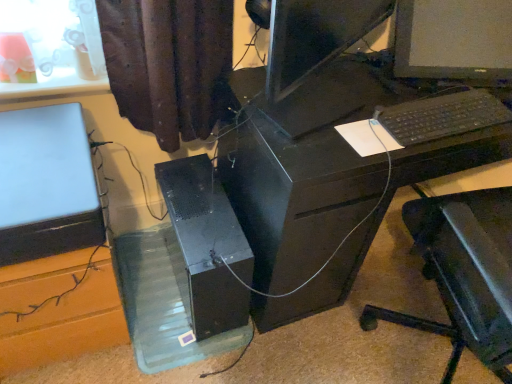
Question: Are black plastic keyboard at right and transparent plastic glass box at lower center located far from each other?

Choices:
 (A) yes
 (B) no

Answer: (B)

Question: Can transparent plastic glass box at lower center be found inside black plastic keyboard at right?

Choices:
 (A) no
 (B) yes

Answer: (A)

Question: Is the depth of black plastic keyboard at right less than that of transparent plastic glass box at lower center?

Choices:
 (A) no
 (B) yes

Answer: (B)

Question: Is transparent plastic glass box at lower center at the back of black plastic keyboard at right?

Choices:
 (A) no
 (B) yes

Answer: (A)

Question: Is black plastic keyboard at right taller than transparent plastic glass box at lower center?

Choices:
 (A) no
 (B) yes

Answer: (A)

Question: Is black plastic keyboard at right to the left of transparent plastic glass box at lower center from the viewer's perspective?

Choices:
 (A) yes
 (B) no

Answer: (B)

Question: Would you say black plastic desk at center contains black matte computer tower at center?

Choices:
 (A) no
 (B) yes

Answer: (A)

Question: Does black plastic desk at center come in front of black matte computer tower at center?

Choices:
 (A) no
 (B) yes

Answer: (B)

Question: From a real-world perspective, is black plastic desk at center on black matte computer tower at center?

Choices:
 (A) yes
 (B) no

Answer: (A)

Question: Does black plastic desk at center come behind black matte computer tower at center?

Choices:
 (A) yes
 (B) no

Answer: (B)

Question: Is black plastic desk at center not close to black matte computer tower at center?

Choices:
 (A) no
 (B) yes

Answer: (A)

Question: Is black plastic desk at center outside black matte computer tower at center?

Choices:
 (A) no
 (B) yes

Answer: (B)

Question: Does matte black monitor at center have a larger size compared to black plastic desk at center?

Choices:
 (A) yes
 (B) no

Answer: (B)